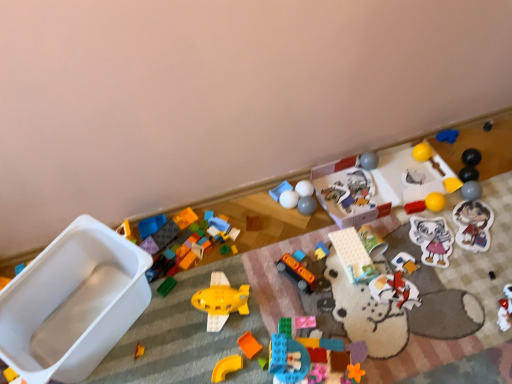
Locate an element on the screen. This screenshot has height=384, width=512. unoccupied region to the right of white glossy sticker at center-right, which is counted as the sixth toy, starting from the right is located at coordinates (477, 240).